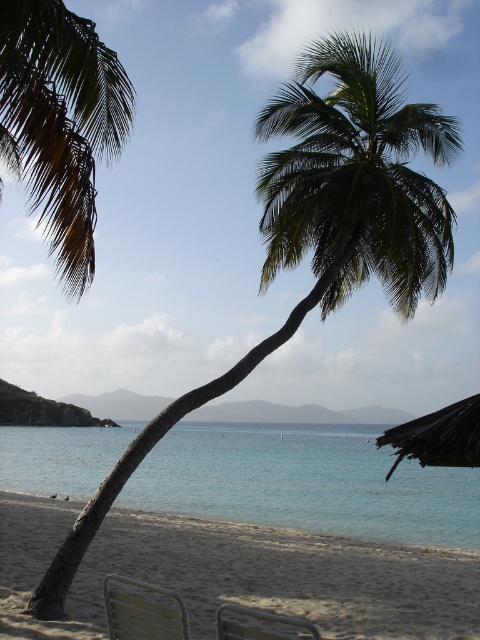
Question: Can you confirm if sandy beige at lower left is positioned above dark brown wooden umbrella at lower right?

Choices:
 (A) no
 (B) yes

Answer: (A)

Question: Which point is closer to the camera?

Choices:
 (A) clear blue water at lower center
 (B) metallic silver beach chair at lower center
 (C) metallic silver chair at lower center

Answer: (C)

Question: Which of the following is the closest to the observer?

Choices:
 (A) brown/dry palm tree at upper left
 (B) dark brown wooden umbrella at lower right
 (C) metallic silver chair at lower center
 (D) sandy beige at lower left

Answer: (C)

Question: Considering the real-world distances, which object is farthest from the dark brown wooden umbrella at lower right?

Choices:
 (A) clear blue water at lower center
 (B) metallic silver beach chair at lower center
 (C) metallic silver chair at lower center

Answer: (A)

Question: Can you confirm if clear blue water at lower center is thinner than dark brown wooden umbrella at lower right?

Choices:
 (A) yes
 (B) no

Answer: (B)

Question: Is sandy beige at lower left wider than clear blue water at lower center?

Choices:
 (A) no
 (B) yes

Answer: (A)